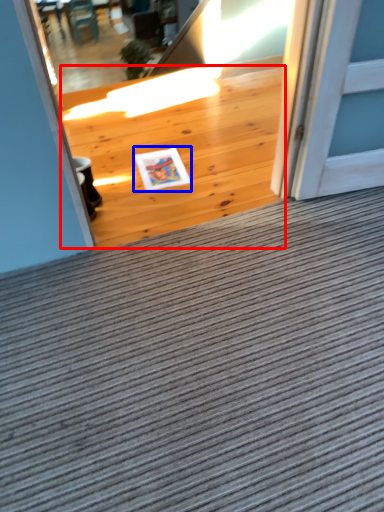
Question: Which object appears farthest to the camera in this image, hardwood (highlighted by a red box) or postcard (highlighted by a blue box)?

Choices:
 (A) hardwood
 (B) postcard

Answer: (B)